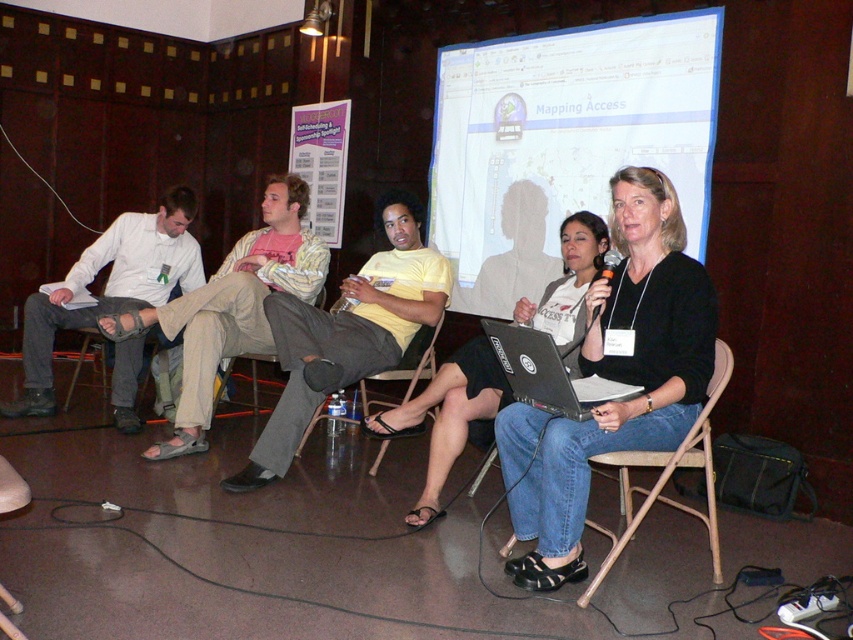
Question: Which of the following is the farthest from the observer?

Choices:
 (A) (648, 321)
 (B) (496, 353)
 (C) (268, 182)

Answer: (C)

Question: Can you confirm if jeansmaterial at center is thinner than black plastic microphone at center?

Choices:
 (A) no
 (B) yes

Answer: (A)

Question: Does black fabric shirt at center appear on the left side of black fabric chair at center?

Choices:
 (A) no
 (B) yes

Answer: (A)

Question: Considering the real-world distances, which object is farthest from the yellow matte shirt at center?

Choices:
 (A) black fabric chair at center
 (B) black fabric shirt at center
 (C) tan sandal at center

Answer: (B)

Question: Among these objects, which one is nearest to the camera?

Choices:
 (A) black plastic microphone at center
 (B) white shirt at left
 (C) black fabric chair at center
 (D) tan sandal at center

Answer: (A)

Question: Is tan sandal at center positioned behind black plastic laptop at center?

Choices:
 (A) yes
 (B) no

Answer: (A)